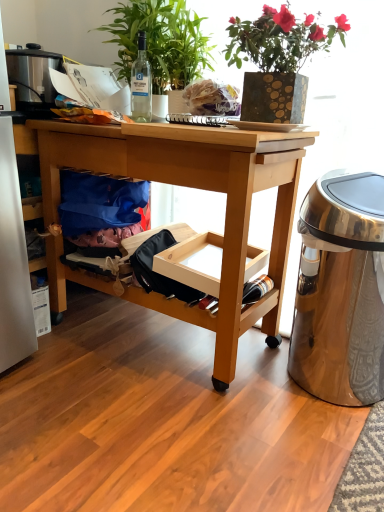
Question: Is white matte plate at center positioned beyond the bounds of gold textured vase at upper center, the 3th houseplant in the left-to-right sequence?

Choices:
 (A) yes
 (B) no

Answer: (A)

Question: Does white matte plate at center have a lesser height compared to gold textured vase at upper center, which appears as the first houseplant when viewed from the right?

Choices:
 (A) no
 (B) yes

Answer: (B)

Question: From the image's perspective, is white matte plate at center on gold textured vase at upper center, which appears as the first houseplant when viewed from the right?

Choices:
 (A) no
 (B) yes

Answer: (A)

Question: Does white matte plate at center have a larger size compared to gold textured vase at upper center, which appears as the first houseplant when viewed from the right?

Choices:
 (A) no
 (B) yes

Answer: (A)

Question: Is white matte plate at center further to the viewer compared to gold textured vase at upper center, the 3th houseplant in the left-to-right sequence?

Choices:
 (A) yes
 (B) no

Answer: (A)

Question: Is point (304, 86) closer or farther from the camera than point (150, 89)?

Choices:
 (A) closer
 (B) farther

Answer: (A)

Question: From a real-world perspective, relative to clear glass bottle at upper center, is gold textured vase at upper center, the 3th houseplant in the left-to-right sequence, vertically above or below?

Choices:
 (A) above
 (B) below

Answer: (A)

Question: In terms of height, does gold textured vase at upper center, the 3th houseplant in the left-to-right sequence, look taller or shorter compared to clear glass bottle at upper center?

Choices:
 (A) tall
 (B) short

Answer: (A)

Question: Is gold textured vase at upper center, the 3th houseplant in the left-to-right sequence, bigger or smaller than clear glass bottle at upper center?

Choices:
 (A) small
 (B) big

Answer: (B)

Question: Considering the relative positions of gold textured vase at upper center, which appears as the first houseplant when viewed from the right, and blue fabric bag at lower left in the image provided, is gold textured vase at upper center, which appears as the first houseplant when viewed from the right, to the left or to the right of blue fabric bag at lower left?

Choices:
 (A) left
 (B) right

Answer: (B)

Question: Relative to blue fabric bag at lower left, is gold textured vase at upper center, the 3th houseplant in the left-to-right sequence, in front or behind?

Choices:
 (A) behind
 (B) front

Answer: (B)

Question: Based on their sizes in the image, would you say gold textured vase at upper center, which appears as the first houseplant when viewed from the right, is bigger or smaller than blue fabric bag at lower left?

Choices:
 (A) big
 (B) small

Answer: (A)

Question: From a real-world perspective, relative to blue fabric bag at lower left, is gold textured vase at upper center, which appears as the first houseplant when viewed from the right, vertically above or below?

Choices:
 (A) above
 (B) below

Answer: (A)

Question: In terms of size, does blue fabric bag at lower left appear bigger or smaller than green leafy plant at upper center, which is the third houseplant in right-to-left order?

Choices:
 (A) small
 (B) big

Answer: (A)

Question: From the image's perspective, is blue fabric bag at lower left positioned above or below green leafy plant at upper center, which is the third houseplant in right-to-left order?

Choices:
 (A) above
 (B) below

Answer: (B)